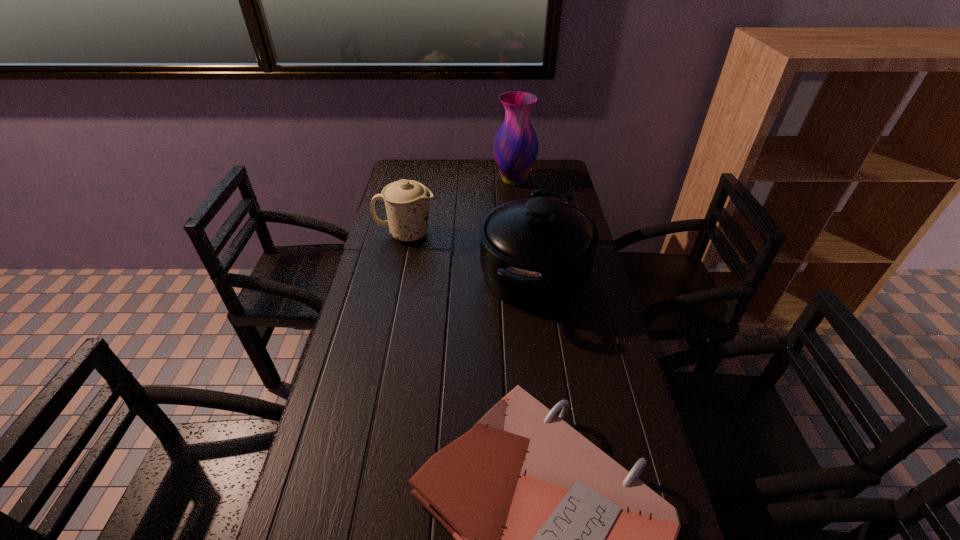
At what (x,y) coordinates should I click in order to perform the action: click on vacant position in the image that satisfies the following two spatial constraints: 1. on the spout of the saucepan; 2. on the left side of the second shortest object. Please return your answer as a coordinate pair (x, y). Looking at the image, I should click on point(397,276).

The image size is (960, 540). I want to click on vacant space that satisfies the following two spatial constraints: 1. on the spout of the chinaware; 2. on the left side of the saucepan, so click(x=397, y=276).

Where is `vacant area in the image that satisfies the following two spatial constraints: 1. on the spout of the leftmost object; 2. on the left side of the second tallest object`? The image size is (960, 540). vacant area in the image that satisfies the following two spatial constraints: 1. on the spout of the leftmost object; 2. on the left side of the second tallest object is located at coordinates (397, 276).

The height and width of the screenshot is (540, 960). Identify the location of vacant point that satisfies the following two spatial constraints: 1. on the spout of the leftmost object; 2. on the left side of the second tallest object. click(x=397, y=276).

Locate an element on the screen. Image resolution: width=960 pixels, height=540 pixels. free space that satisfies the following two spatial constraints: 1. on the spout of the third tallest object; 2. on the left side of the third shortest object is located at coordinates (397, 276).

Locate an element on the screen. The image size is (960, 540). free space that satisfies the following two spatial constraints: 1. on the spout of the saucepan; 2. on the right side of the chinaware is located at coordinates (397, 276).